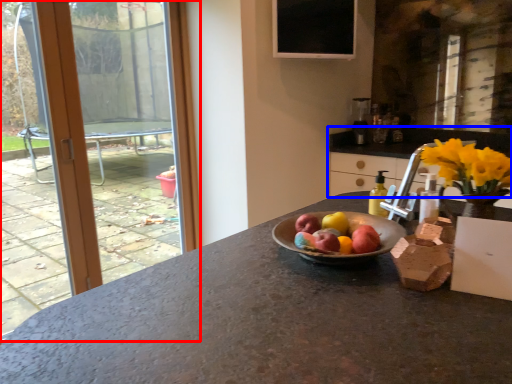
Question: Which object appears closest to the camera in this image, window (highlighted by a red box) or cabinetry (highlighted by a blue box)?

Choices:
 (A) window
 (B) cabinetry

Answer: (B)